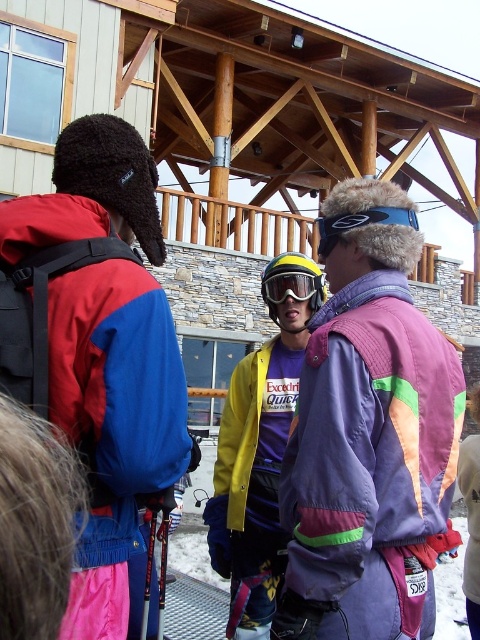
Who is shorter, matte blue jacket at center or clear plastic goggles at center?

clear plastic goggles at center is shorter.

Can you confirm if matte blue jacket at center is wider than clear plastic goggles at center?

Yes, matte blue jacket at center is wider than clear plastic goggles at center.

Between point (83, 580) and point (261, 288), which one is positioned behind?

The point (261, 288) is behind.

This screenshot has width=480, height=640. I want to click on matte blue jacket at center, so (x=113, y=420).

Is purple fleece jacket at center thinner than yellow matte jacket at center?

Incorrect, purple fleece jacket at center's width is not less than yellow matte jacket at center's.

Between purple fleece jacket at center and yellow matte jacket at center, which one has less height?

purple fleece jacket at center is shorter.

Does point (362, 323) come closer to viewer compared to point (266, 506)?

Yes, point (362, 323) is closer to viewer.

I want to click on purple fleece jacket at center, so click(369, 435).

Is purple fleece jacket at center in front of matte blue jacket at center?

That is False.

Who is more forward, (376, 196) or (66, 621)?

Point (66, 621) is more forward.

This screenshot has width=480, height=640. Identify the location of purple fleece jacket at center. (369, 435).